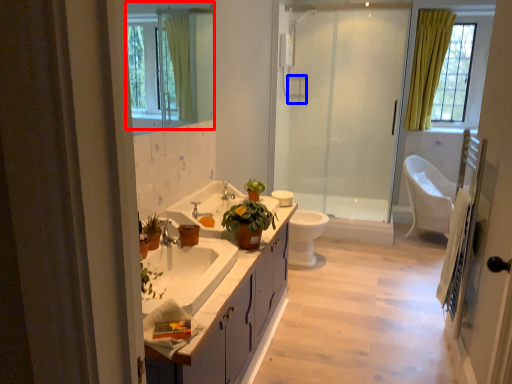
Question: Which object is further to the camera taking this photo, mirror (highlighted by a red box) or towel bar (highlighted by a blue box)?

Choices:
 (A) mirror
 (B) towel bar

Answer: (B)